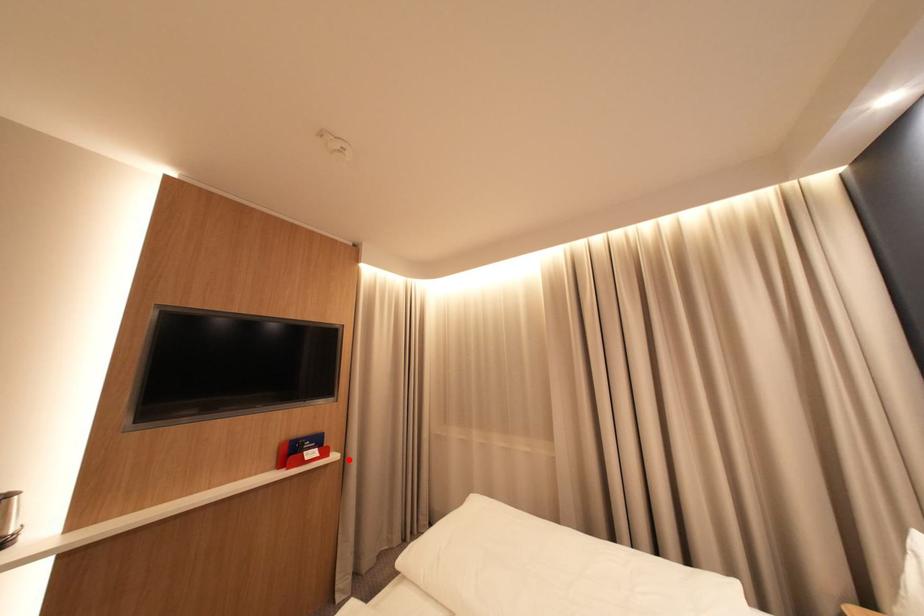
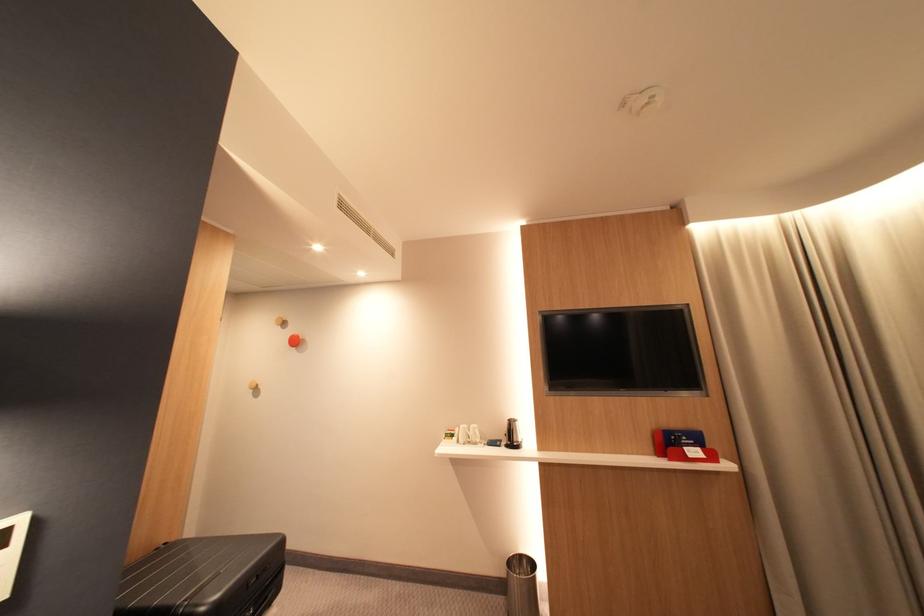
Locate, in the second image, the point that corresponds to the highlighted location in the first image.

(747, 471)